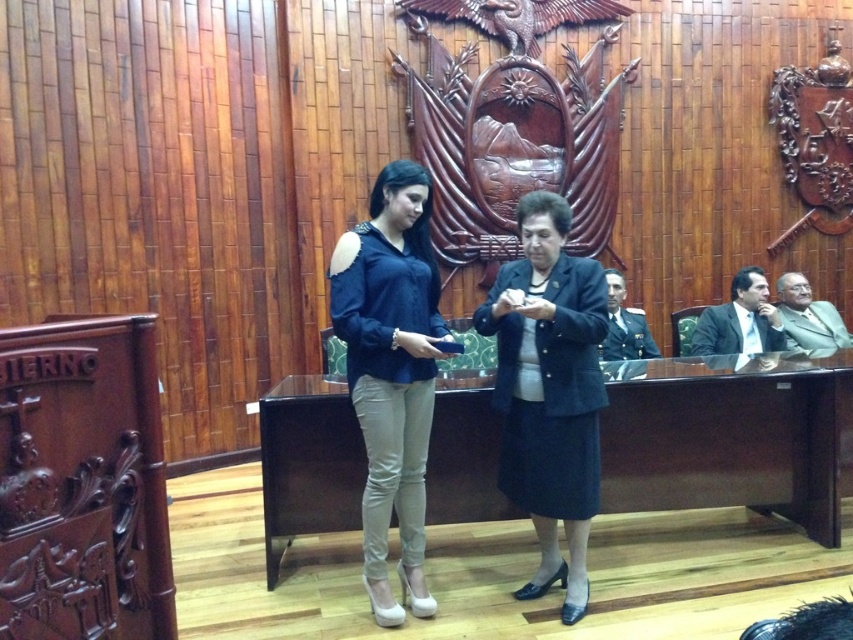
Question: Which object appears farthest from the camera in this image?

Choices:
 (A) brown wood table at center
 (B) gray wool suit at right
 (C) matte blue blouse at center

Answer: (B)

Question: Which point appears closest to the camera in this image?

Choices:
 (A) (624, 342)
 (B) (732, 339)

Answer: (A)

Question: Is matte blue blouse at center wider than gray wool suit at right?

Choices:
 (A) yes
 (B) no

Answer: (B)

Question: Which point is farther to the camera?

Choices:
 (A) matte black suit at right
 (B) dark green uniform at right
 (C) gray wool suit at right

Answer: (C)

Question: Is matte blue blouse at center thinner than dark green uniform at right?

Choices:
 (A) no
 (B) yes

Answer: (A)

Question: Can you confirm if matte blue blouse at center is positioned to the right of matte black suit at right?

Choices:
 (A) yes
 (B) no

Answer: (B)